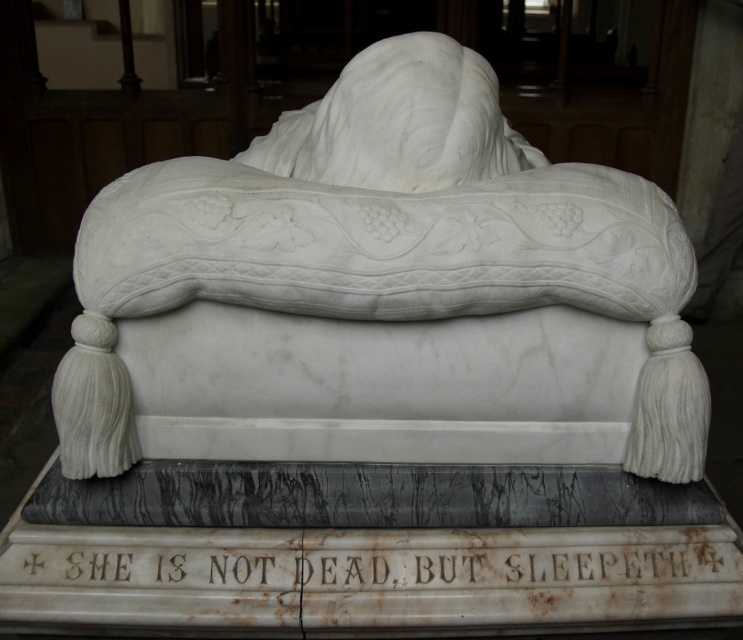
Between white marble bed at center and white marble text at center, which one appears on the right side from the viewer's perspective?

white marble text at center

Is point (421, 413) positioned in front of point (510, 577)?

No, (421, 413) is behind (510, 577).

Identify the location of white marble bed at center. The width and height of the screenshot is (743, 640). (389, 280).